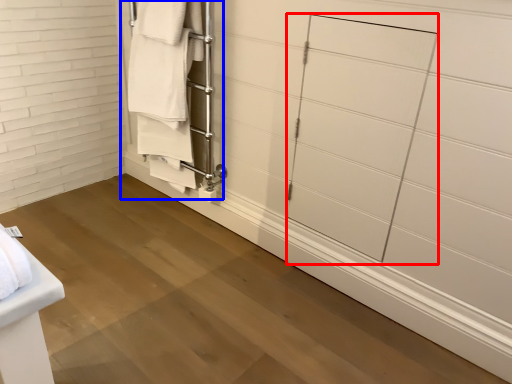
Question: Which point is further to the camera, glass door (highlighted by a red box) or closet (highlighted by a blue box)?

Choices:
 (A) glass door
 (B) closet

Answer: (B)